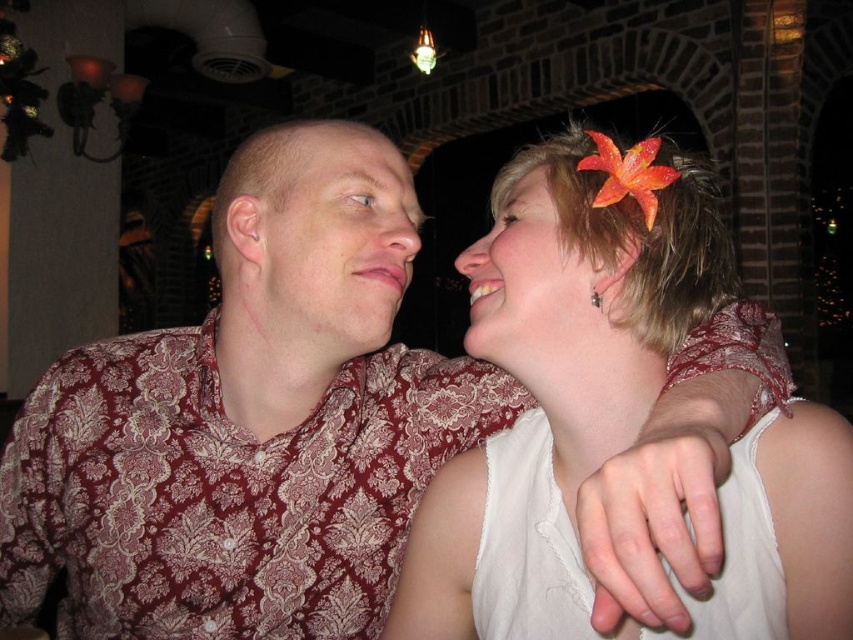
Question: Among these points, which one is nearest to the camera?

Choices:
 (A) (531, 211)
 (B) (299, 268)
 (C) (415, 157)
 (D) (685, 264)

Answer: (D)

Question: Among these objects, which one is farthest from the camera?

Choices:
 (A) matte skin at center
 (B) matte floral shirt at left
 (C) white fabric flower at upper right

Answer: (A)

Question: Does white fabric flower at upper right have a smaller size compared to white matte flower at upper right?

Choices:
 (A) yes
 (B) no

Answer: (B)

Question: Is white fabric flower at upper right bigger than white matte flower at upper right?

Choices:
 (A) yes
 (B) no

Answer: (A)

Question: Which point is closer to the camera?

Choices:
 (A) (410, 168)
 (B) (631, 275)
 (C) (515, 204)
 (D) (383, 202)

Answer: (B)

Question: Is white fabric flower at upper right wider than matte skin at center?

Choices:
 (A) no
 (B) yes

Answer: (B)